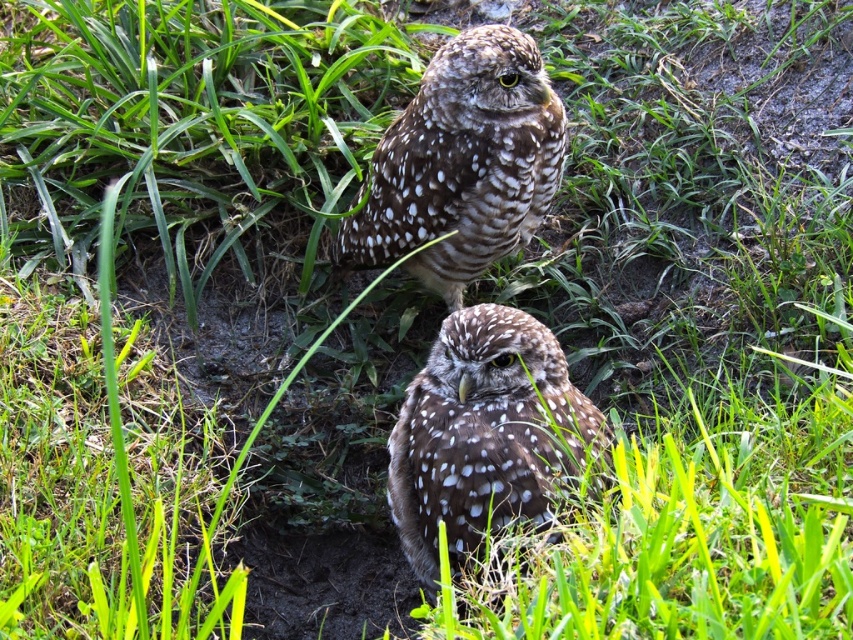
How distant is speckled brown owl at upper center from speckled brown owl at center?

Result: speckled brown owl at upper center and speckled brown owl at center are 23.31 inches apart from each other.

Identify the location of speckled brown owl at upper center. This screenshot has height=640, width=853. coord(462,164).

You are a GUI agent. You are given a task and a screenshot of the screen. Output one action in this format:
    pyautogui.click(x=<x>, y=<y>)
    Task: Click on the speckled brown owl at upper center
    
    Given the screenshot: What is the action you would take?
    pyautogui.click(x=462, y=164)